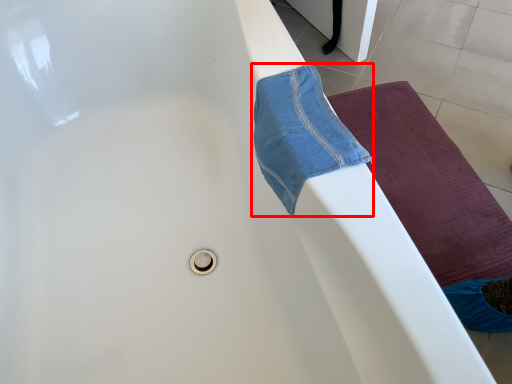
Question: From the image's perspective, what is the correct spatial positioning of beach towel (annotated by the red box) in reference to yoga mat?

Choices:
 (A) above
 (B) below

Answer: (A)